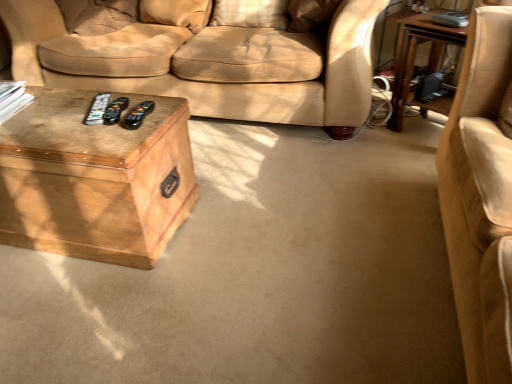
Question: Can you confirm if black plastic remote at center, marked as the 3th remote in a right-to-left arrangement, is thinner than black plastic remote at center, the 2th remote viewed from the left?

Choices:
 (A) no
 (B) yes

Answer: (A)

Question: Is black plastic remote at center, marked as the 3th remote in a right-to-left arrangement, further to camera compared to black plastic remote at center, the 2th remote viewed from the left?

Choices:
 (A) yes
 (B) no

Answer: (A)

Question: Is black plastic remote at center, the 1th remote in the left-to-right sequence, outside of black plastic remote at center, arranged as the 2th remote when viewed from the right?

Choices:
 (A) no
 (B) yes

Answer: (B)

Question: Is black plastic remote at center, the 1th remote in the left-to-right sequence, far away from black plastic remote at center, the 2th remote viewed from the left?

Choices:
 (A) yes
 (B) no

Answer: (B)

Question: Can you see black plastic remote at center, the 1th remote in the left-to-right sequence, touching black plastic remote at center, the 2th remote viewed from the left?

Choices:
 (A) yes
 (B) no

Answer: (A)

Question: From a real-world perspective, is wooden trunk at lower left, acting as the first table starting from the left, physically located above or below black plastic remote at center, marked as the 3th remote in a right-to-left arrangement?

Choices:
 (A) above
 (B) below

Answer: (B)

Question: Based on their positions, is wooden trunk at lower left, which is the second table in right-to-left order, located to the left or right of black plastic remote at center, marked as the 3th remote in a right-to-left arrangement?

Choices:
 (A) right
 (B) left

Answer: (B)

Question: In terms of size, does wooden trunk at lower left, which is the second table in right-to-left order, appear bigger or smaller than black plastic remote at center, marked as the 3th remote in a right-to-left arrangement?

Choices:
 (A) big
 (B) small

Answer: (A)

Question: From their relative heights in the image, would you say wooden trunk at lower left, acting as the first table starting from the left, is taller or shorter than black plastic remote at center, marked as the 3th remote in a right-to-left arrangement?

Choices:
 (A) short
 (B) tall

Answer: (B)

Question: In terms of size, does black plastic remote at center, which is counted as the first remote, starting from the right, appear bigger or smaller than black plastic remote at center, marked as the 3th remote in a right-to-left arrangement?

Choices:
 (A) big
 (B) small

Answer: (A)

Question: Would you say black plastic remote at center, the 3th remote in the left-to-right sequence, is inside or outside black plastic remote at center, marked as the 3th remote in a right-to-left arrangement?

Choices:
 (A) inside
 (B) outside

Answer: (B)

Question: From the image's perspective, is black plastic remote at center, which is counted as the first remote, starting from the right, positioned above or below black plastic remote at center, the 1th remote in the left-to-right sequence?

Choices:
 (A) above
 (B) below

Answer: (B)

Question: From their relative heights in the image, would you say black plastic remote at center, which is counted as the first remote, starting from the right, is taller or shorter than black plastic remote at center, the 1th remote in the left-to-right sequence?

Choices:
 (A) tall
 (B) short

Answer: (A)

Question: Based on their sizes in the image, would you say wooden trunk at lower left, acting as the first table starting from the left, is bigger or smaller than wooden table at right, arranged as the first table when viewed from the right?

Choices:
 (A) small
 (B) big

Answer: (B)

Question: Considering their positions, is wooden trunk at lower left, which is the second table in right-to-left order, located in front of or behind wooden table at right, arranged as the first table when viewed from the right?

Choices:
 (A) behind
 (B) front

Answer: (B)